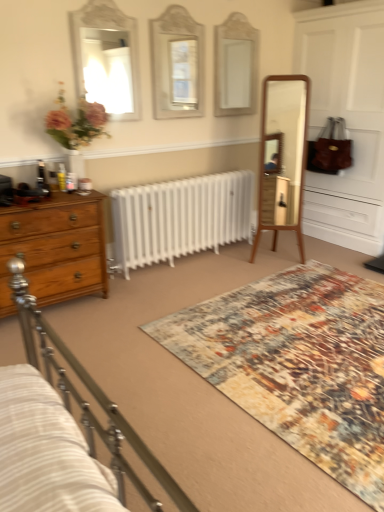
Find the location of a particular element. This screenshot has width=384, height=512. vacant space underneath matte white mirror at center, the second mirror in the left-to-right sequence (from a real-world perspective) is located at coordinates (178, 138).